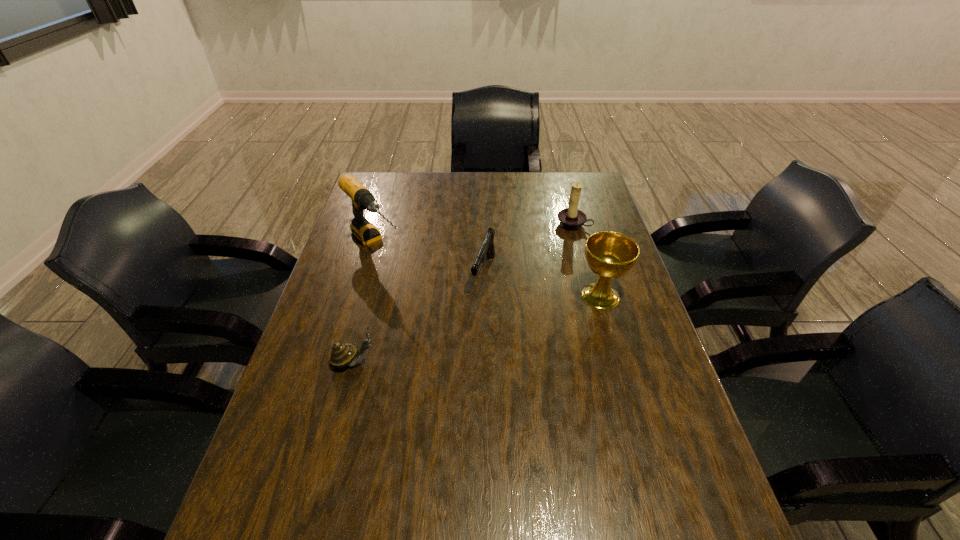
This screenshot has height=540, width=960. Find the location of `free space located 0.090m at the aiming end of the third object from right to left`. free space located 0.090m at the aiming end of the third object from right to left is located at coordinates (472, 319).

The width and height of the screenshot is (960, 540). Find the location of `free space located 0.190m at the aiming end of the third object from right to left`. free space located 0.190m at the aiming end of the third object from right to left is located at coordinates (462, 346).

This screenshot has height=540, width=960. Find the location of `vacant area situated 0.220m at the aiming end of the third object from right to left`. vacant area situated 0.220m at the aiming end of the third object from right to left is located at coordinates (458, 355).

At what (x,y) coordinates should I click in order to perform the action: click on free point located on the handle side of the drill. Please return your answer as a coordinate pair (x, y). The width and height of the screenshot is (960, 540). Looking at the image, I should click on (432, 309).

At what (x,y) coordinates should I click in order to perform the action: click on vacant space located on the handle side of the drill. Please return your answer as a coordinate pair (x, y). Looking at the image, I should click on (422, 300).

This screenshot has height=540, width=960. What are the coordinates of `vacant space located 0.400m on the handle side of the drill` in the screenshot? It's located at (468, 347).

The height and width of the screenshot is (540, 960). In order to click on snail that is positioned at the left edge in this screenshot , I will do tap(342, 355).

Locate an element on the screen. drill located at the left edge is located at coordinates (362, 199).

What are the coordinates of `chalice located at the right edge` in the screenshot? It's located at (610, 255).

Where is `candle holder present at the right edge`? candle holder present at the right edge is located at coordinates (571, 218).